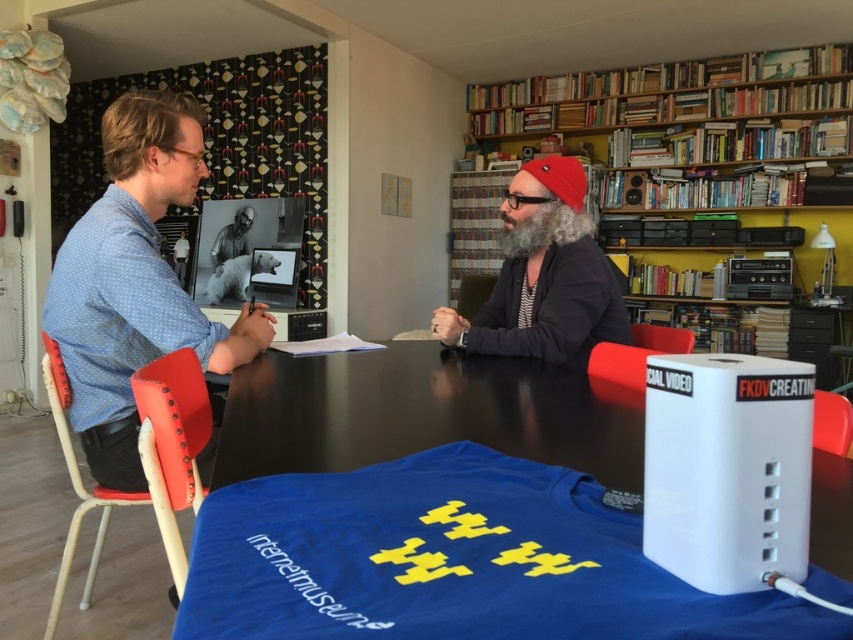
Is blue dotted shirt at left closer to the viewer compared to graywoollybeard at center?

Yes.

Is blue dotted shirt at left taller than graywoollybeard at center?

Yes, blue dotted shirt at left is taller than graywoollybeard at center.

This screenshot has width=853, height=640. Describe the element at coordinates (134, 282) in the screenshot. I see `blue dotted shirt at left` at that location.

This screenshot has width=853, height=640. Identify the location of blue dotted shirt at left. (134, 282).

Which of these two, black glossy table at center or wooden bookshelf at upper right, stands taller?

→ wooden bookshelf at upper right is taller.

Who is more distant from viewer, [523,509] or [749,141]?

The point [749,141] is more distant.

Identify the location of black glossy table at center. Image resolution: width=853 pixels, height=640 pixels. (451, 561).

Is black glossy table at center bigger than blue dotted shirt at left?

Actually, black glossy table at center might be smaller than blue dotted shirt at left.

Who is more distant from viewer, (316,636) or (107,349)?

The point (107,349) is more distant.

Where is `black glossy table at center`? This screenshot has width=853, height=640. black glossy table at center is located at coordinates coord(451,561).